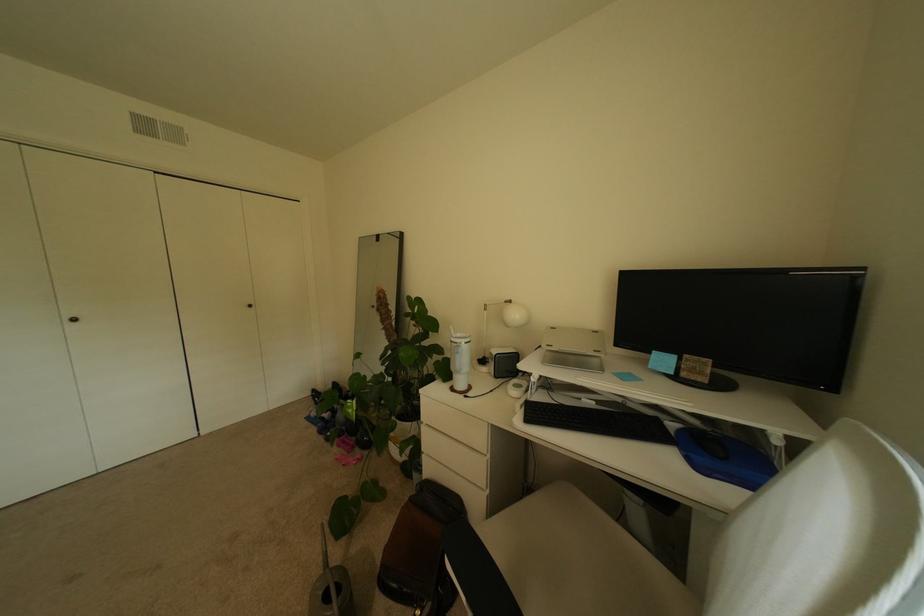
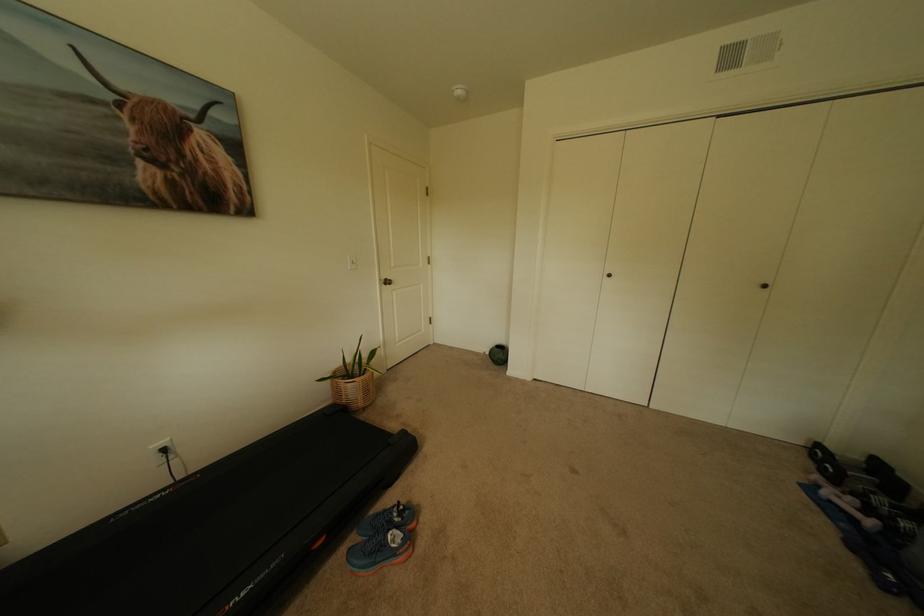
Question: The camera is either moving clockwise (left) or counter-clockwise (right) around the object. The first image is from the beginning of the video and the second image is from the end. Is the camera moving left or right when shooting the video?

Choices:
 (A) Left
 (B) Right

Answer: (B)